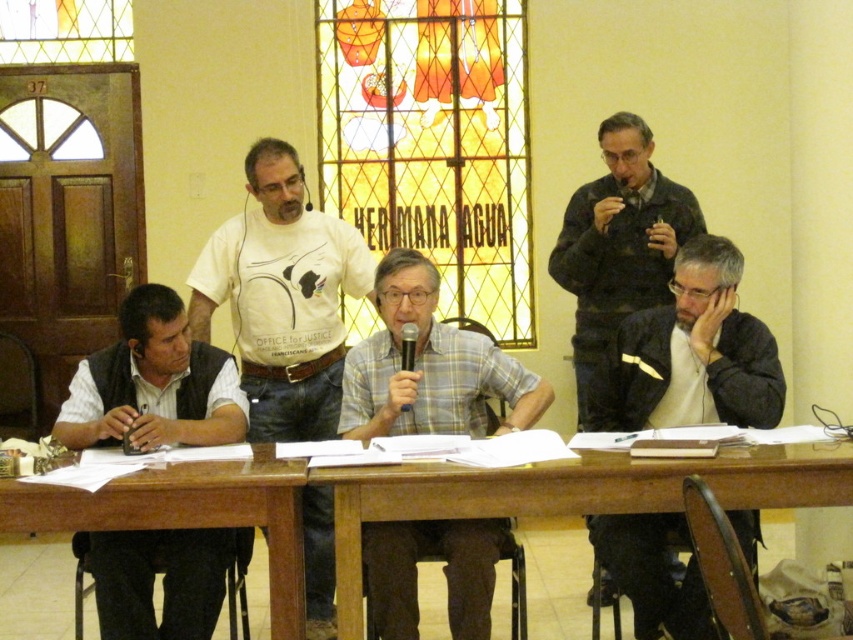
You are organizing a photo shoot and need to arrange two items from the scene for a closeup. The items are the plaid fabric shirt at center and the dark gray fabric jacket at upper right. Which item should you choose if you want to focus on the smaller one?

The plaid fabric shirt at center should be chosen for the closeup because it occupies less space than the dark gray fabric jacket at upper right.

You are standing in the room where the meeting is taking place. You need to locate the plaid fabric shirt at center. Where exactly is it located?

The plaid fabric shirt at center is located at point (428, 365).